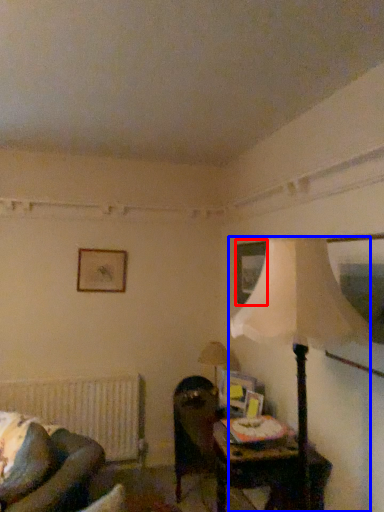
Question: Among these objects, which one is nearest to the camera, picture frame (highlighted by a red box) or lamp (highlighted by a blue box)?

Choices:
 (A) picture frame
 (B) lamp

Answer: (B)